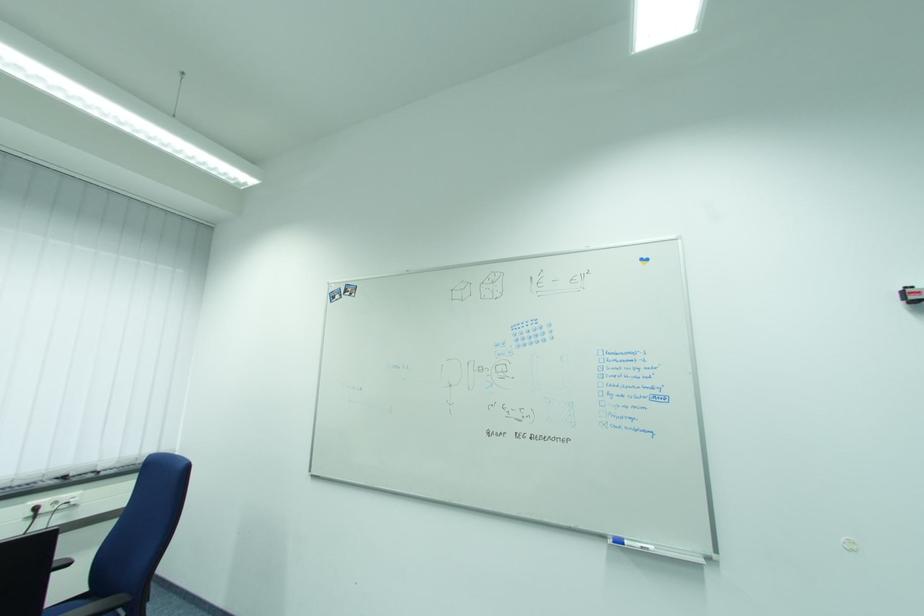
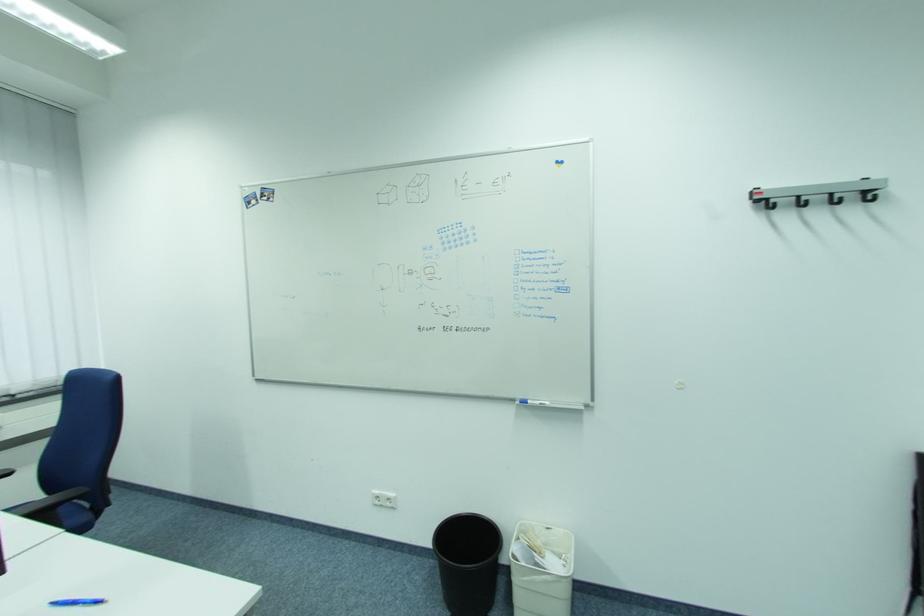
Find the pixel in the second image that matches point 629,544 in the first image.

(533, 403)